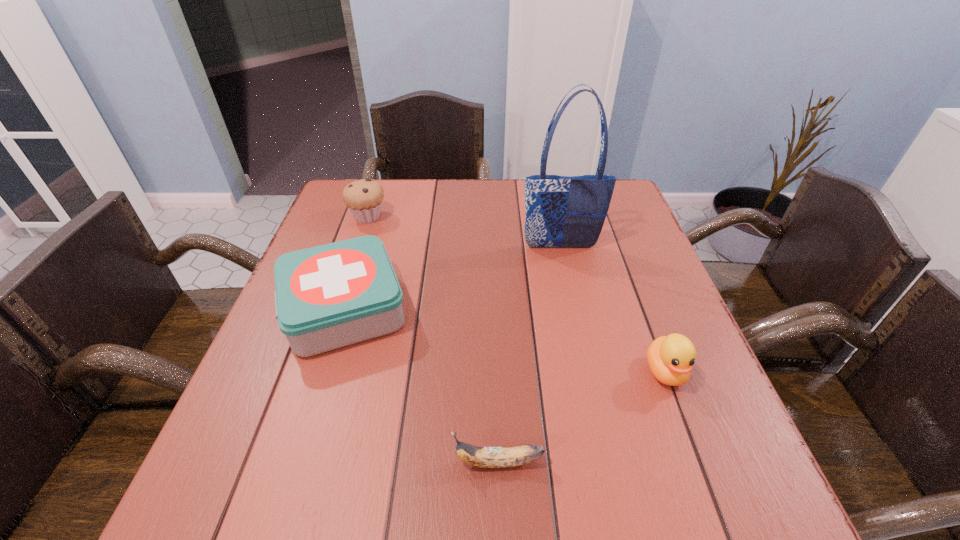
Where is `vacant space that satisfies the following two spatial constraints: 1. on the front-facing side of the tallest object; 2. at the stem of the nearest object`? vacant space that satisfies the following two spatial constraints: 1. on the front-facing side of the tallest object; 2. at the stem of the nearest object is located at coordinates (608, 462).

In order to click on free space that satisfies the following two spatial constraints: 1. on the front-facing side of the shopping bag; 2. at the stem of the nearest object in this screenshot , I will do `click(608, 462)`.